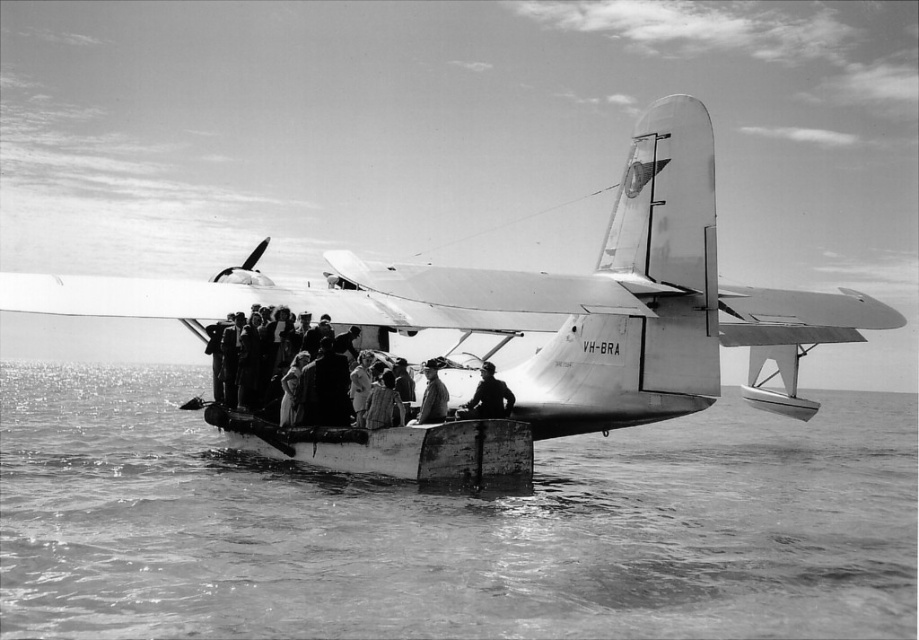
You are a photographer standing on the dock, and you want to take a photo of the wooden boat at center and the smooth leather jacket at center. Which object should you focus on first if you want to capture both in the frame without moving your camera?

The wooden boat at center is to the left of smooth leather jacket at center, so you should focus on the wooden boat at center first to ensure both are in the frame without moving the camera.

You are standing on the wooden float of the seaplane and want to move towards the tail section. Which point, point (577, 424) or point (441, 404), is closer to you as you face the direction of the tail?

Point (577, 424) is closer to you because it is further to the viewer than point (441, 404), meaning it is nearer your current position on the wooden float.

You are standing at the camera position and want to take a photo of the metallic fuselage seaplane at center. The camera has a maximum zoom range of 100 meters. Can you capture the seaplane in your photo without moving closer?

The metallic fuselage seaplane at center and camera are 87.13 meters apart from each other. Since the camera can zoom up to 100 meters, you can capture the seaplane without moving closer.